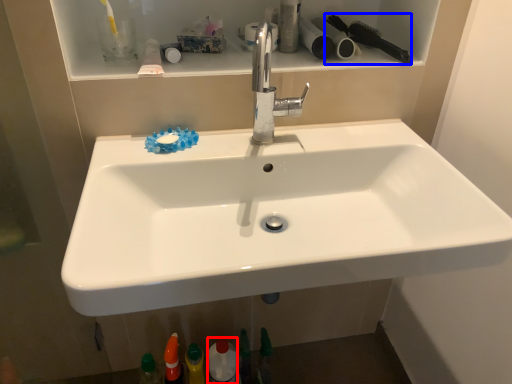
Question: Which of the following is the farthest to the observer, mouthwash (highlighted by a red box) or brush (highlighted by a blue box)?

Choices:
 (A) mouthwash
 (B) brush

Answer: (A)